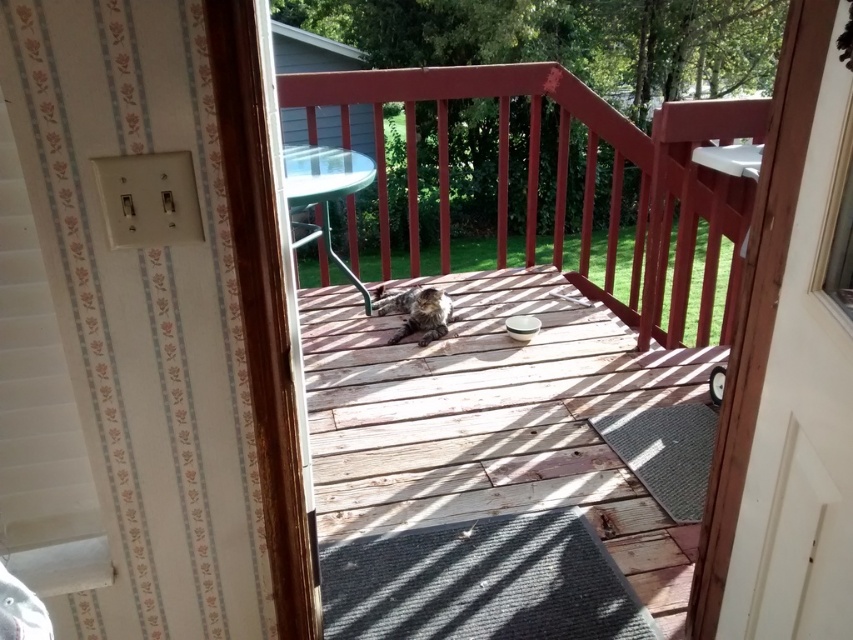
From the picture: Is weathered wood deck at center thinner than wooden deck at center?

Correct, weathered wood deck at center's width is less than wooden deck at center's.

Does weathered wood deck at center have a smaller size compared to wooden deck at center?

Yes, weathered wood deck at center is smaller than wooden deck at center.

Image resolution: width=853 pixels, height=640 pixels. Find the location of `weathered wood deck at center`. weathered wood deck at center is located at coordinates (495, 420).

Is point (489, 488) positioned in front of point (387, 300)?

Yes, it is.

Does weathered wood deck at center appear under fuzzy brown cat at center?

Indeed, weathered wood deck at center is positioned under fuzzy brown cat at center.

Between point (543, 452) and point (395, 332), which one is positioned in front?

Point (543, 452) is in front.

Where is `weathered wood deck at center`? weathered wood deck at center is located at coordinates (495, 420).

Does white wood door at center right appear on the right side of fuzzy brown cat at center?

Yes, white wood door at center right is to the right of fuzzy brown cat at center.

Does point (838, 304) lie behind point (424, 326)?

No, (838, 304) is closer to viewer.

Between point (697, 627) and point (410, 294), which one is positioned behind?

The point (410, 294) is more distant.

Where is `white wood door at center right`? The image size is (853, 640). white wood door at center right is located at coordinates (787, 376).